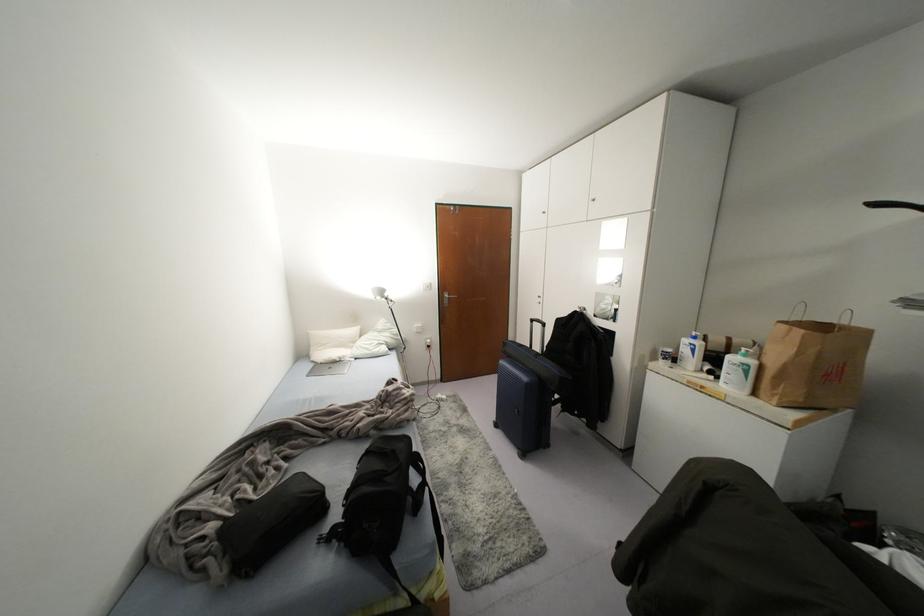
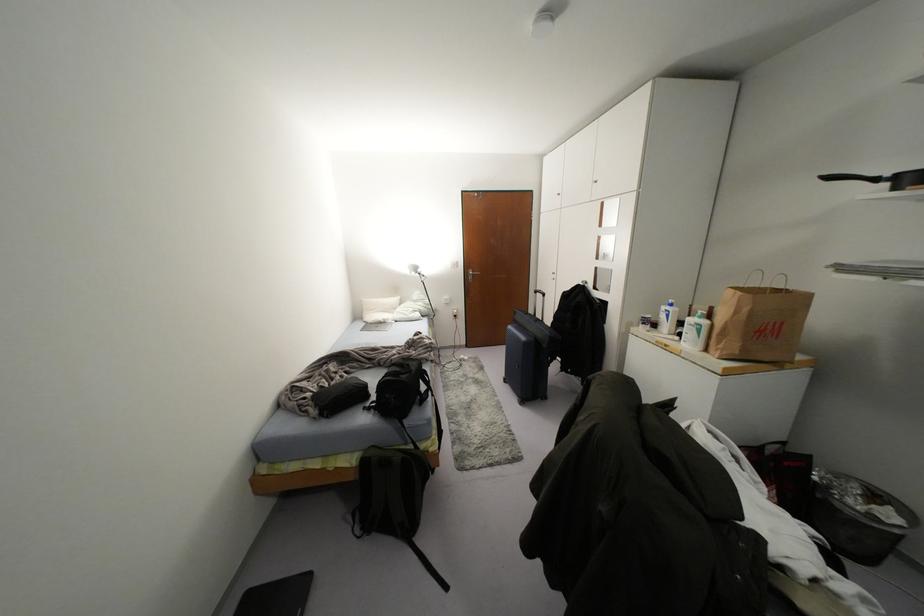
Locate, in the second image, the point that corresponds to pixel 876 204 in the first image.

(829, 177)